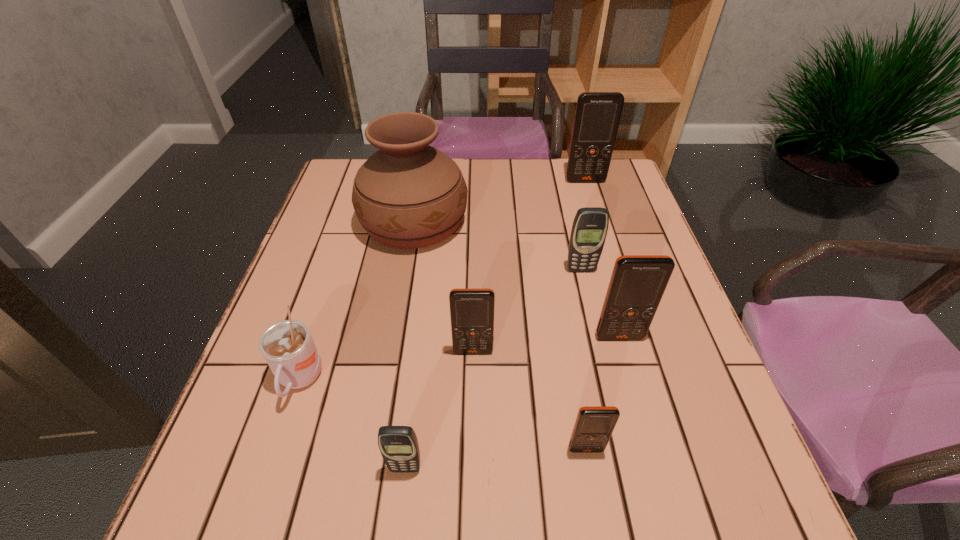
Locate an element on the screen. vacant space at the left edge of the desktop is located at coordinates (309, 256).

At what (x,y) coordinates should I click in order to perform the action: click on vacant point at the right edge. Please return your answer as a coordinate pair (x, y). Looking at the image, I should click on (668, 341).

The width and height of the screenshot is (960, 540). In order to click on vacant space at the far right corner of the desktop in this screenshot , I will do `click(612, 197)`.

At what (x,y) coordinates should I click in order to perform the action: click on free spot between the second nearest orange cellular telephone and the tallest cellular telephone. Please return your answer as a coordinate pair (x, y). Looking at the image, I should click on (529, 266).

Find the location of a particular element. free space between the nearest orange cellular telephone and the seventh nearest object is located at coordinates click(500, 335).

Identify the location of vacant area that lies between the second nearest orange cellular telephone and the cup. This screenshot has width=960, height=540. (386, 366).

Locate an element on the screen. free area in between the cup and the fifth farthest cellular telephone is located at coordinates [443, 415].

Where is `free space between the third nearest cellular telephone and the farther gray cellular telephone`? The height and width of the screenshot is (540, 960). free space between the third nearest cellular telephone and the farther gray cellular telephone is located at coordinates (527, 310).

I want to click on empty location between the cup and the fifth farthest cellular telephone, so click(443, 415).

The image size is (960, 540). What are the coordinates of `blank region between the second farthest object and the seventh farthest object` in the screenshot? It's located at (500, 335).